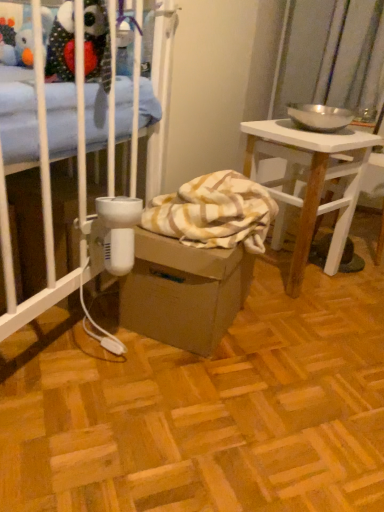
Image resolution: width=384 pixels, height=512 pixels. Identify the location of vacant area that is situated to the right of brown cardboard box at center. (306, 331).